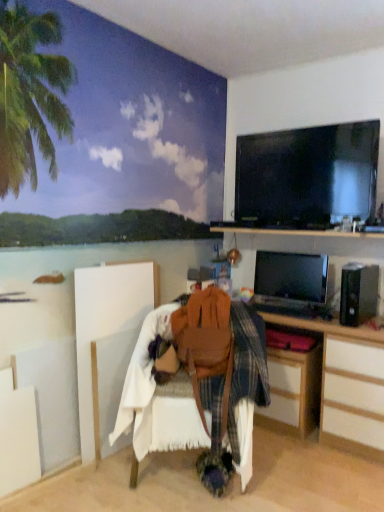
What is the approximate width of black glossy screen at upper right, the first television positioned from the top?

black glossy screen at upper right, the first television positioned from the top, is 5.69 centimeters wide.

Where is `wooden desk at lower right`? The width and height of the screenshot is (384, 512). wooden desk at lower right is located at coordinates (348, 384).

This screenshot has height=512, width=384. In order to click on black glossy screen at upper right, the second television positioned from the bottom in this screenshot , I will do pyautogui.click(x=308, y=175).

What's the angular difference between wooden desk at lower right and black glossy screen at upper right, the first television positioned from the top,'s facing directions?

The facing directions of wooden desk at lower right and black glossy screen at upper right, the first television positioned from the top, are 0.613 degrees apart.

Is black glossy screen at upper right, the first television positioned from the top, located within wooden desk at lower right?

No, black glossy screen at upper right, the first television positioned from the top, is not a part of wooden desk at lower right.

Based on the photo, is wooden desk at lower right not near black glossy screen at upper right, the second television positioned from the bottom?

Actually, wooden desk at lower right and black glossy screen at upper right, the second television positioned from the bottom, are a little close together.

Which object is closer to the camera, wooden desk at lower right or black glossy screen at upper right, the first television positioned from the top?

Positioned in front is wooden desk at lower right.

Is wooden desk at lower right situated inside wooden desk at lower right or outside?

wooden desk at lower right is spatially situated outside wooden desk at lower right.

Are wooden desk at lower right and wooden desk at lower right making contact?

wooden desk at lower right and wooden desk at lower right are clearly separated.

Which is closer to the camera, (321,418) or (305,366)?

The point (305,366) is more forward.

Could you tell me if wooden desk at lower right is facing wooden desk at lower right?

Yes, wooden desk at lower right is turned towards wooden desk at lower right.

Is brown leather bag at center wider than leather at center?

Incorrect, the width of brown leather bag at center does not surpass that of leather at center.

Is point (230, 354) less distant than point (168, 443)?

That is False.

Is brown leather bag at center completely or partially outside of leather at center?

Actually, brown leather bag at center is within leather at center.

Between brown leather bag at center and leather at center, which one has less height?

With less height is brown leather bag at center.

Who is bigger, wooden desk at lower right or leather at center?

leather at center.

Considering the positions of objects wooden desk at lower right and leather at center in the image provided, who is more to the right, wooden desk at lower right or leather at center?

wooden desk at lower right is more to the right.

Can you confirm if wooden desk at lower right is shorter than leather at center?

Yes, wooden desk at lower right is shorter than leather at center.

Is point (266, 417) closer or farther from the camera than point (172, 384)?

Clearly, point (266, 417) is more distant from the camera than point (172, 384).

Are satin black monitor at right, which is the 2th television in top-to-bottom order, and wooden desk at lower right located far from each other?

They are positioned close to each other.

Does satin black monitor at right, which ranks as the first television in bottom-to-top order, appear on the right side of wooden desk at lower right?

No, satin black monitor at right, which ranks as the first television in bottom-to-top order, is not to the right of wooden desk at lower right.

Which is behind, point (258, 264) or point (366, 450)?

The point (258, 264) is farther from the camera.

Which object is closer to the camera, ocean mural at upper left or leather at center?

Positioned in front is ocean mural at upper left.

Where is `backdrop in front of the leather at center`? backdrop in front of the leather at center is located at coordinates (103, 132).

Can you confirm if ocean mural at upper left is positioned to the right of leather at center?

No.

Is ocean mural at upper left far away from leather at center?

Yes, ocean mural at upper left and leather at center are located far from each other.

Based on the photo, can you confirm if black glossy screen at upper right, the first television positioned from the top, is taller than wooden desk at lower right?

→ Indeed, black glossy screen at upper right, the first television positioned from the top, has a greater height compared to wooden desk at lower right.

From a real-world perspective, is black glossy screen at upper right, the first television positioned from the top, under wooden desk at lower right?

No, from a real-world perspective, black glossy screen at upper right, the first television positioned from the top, is not below wooden desk at lower right.

Is wooden desk at lower right inside black glossy screen at upper right, the first television positioned from the top?

No.

Is black glossy screen at upper right, the first television positioned from the top, positioned behind wooden desk at lower right?

No, the depth of black glossy screen at upper right, the first television positioned from the top, is less than that of wooden desk at lower right.

There is a wooden desk at lower right. Identify the location of the 2nd television above it (from a real-world perspective). (308, 175).

At what (x,y) coordinates should I click in order to perform the action: click on cabinetry below the wooden desk at lower right (from the image's perspective). Please return your answer as a coordinate pair (x, y). The width and height of the screenshot is (384, 512). Looking at the image, I should click on (293, 391).

Based on their spatial positions, is satin black monitor at right, which is the 2th television in top-to-bottom order, or wooden desk at lower right closer to leather at center?

Based on the image, wooden desk at lower right appears to be nearer to leather at center.

Based on their spatial positions, is ocean mural at upper left or wooden desk at lower right closer to satin black monitor at right, which ranks as the first television in bottom-to-top order?

Based on the image, wooden desk at lower right appears to be nearer to satin black monitor at right, which ranks as the first television in bottom-to-top order.

Looking at the image, which one is located closer to leather at center, black glossy screen at upper right, the first television positioned from the top, or brown leather bag at center?

Among the two, brown leather bag at center is located nearer to leather at center.

Based on the photo, when comparing their distances from leather at center, does satin black monitor at right, which is the 2th television in top-to-bottom order, or black glossy screen at upper right, the second television positioned from the bottom, seem closer?

satin black monitor at right, which is the 2th television in top-to-bottom order.

Looking at the image, which one is located closer to black glossy screen at upper right, the second television positioned from the bottom, satin black monitor at right, which ranks as the first television in bottom-to-top order, or brown leather bag at center?

satin black monitor at right, which ranks as the first television in bottom-to-top order, is closer to black glossy screen at upper right, the second television positioned from the bottom.

When comparing their distances from wooden desk at lower right, does black glossy screen at upper right, the second television positioned from the bottom, or brown leather bag at center seem closer?

brown leather bag at center lies closer to wooden desk at lower right than the other object.

Which object lies nearer to the anchor point brown leather bag at center, leather at center or satin black monitor at right, which is the 2th television in top-to-bottom order?

leather at center lies closer to brown leather bag at center than the other object.

When comparing their distances from wooden desk at lower right, does black glossy screen at upper right, the first television positioned from the top, or wooden desk at lower right seem closer?

Based on the image, wooden desk at lower right appears to be nearer to wooden desk at lower right.

Locate an element on the screen. This screenshot has width=384, height=512. desk located between leather at center and satin black monitor at right, which ranks as the first television in bottom-to-top order, in the depth direction is located at coordinates (348, 384).

Identify the location of cabinetry between leather at center and satin black monitor at right, which ranks as the first television in bottom-to-top order, from front to back. This screenshot has width=384, height=512. (293, 391).

Locate an element on the screen. swivel chair between black glossy screen at upper right, the first television positioned from the top, and leather at center, in the vertical direction is located at coordinates (206, 344).

Locate an element on the screen. The image size is (384, 512). backdrop between black glossy screen at upper right, the second television positioned from the bottom, and brown leather bag at center, in the vertical direction is located at coordinates (103, 132).